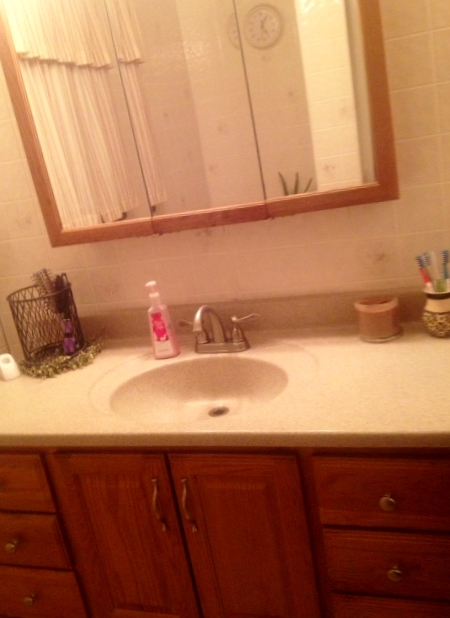
Locate an element on the screen. Image resolution: width=450 pixels, height=618 pixels. wooden bathroom cabinet doors is located at coordinates (152, 540), (203, 544).